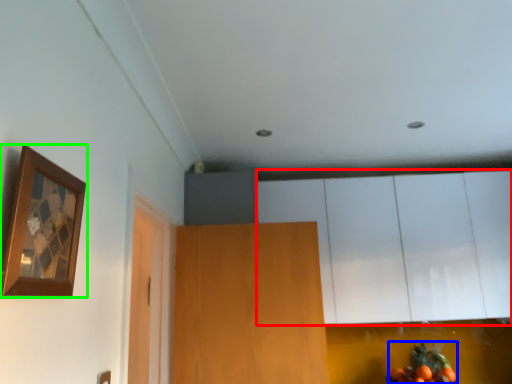
Question: Which object is the farthest from cabinetry (highlighted by a red box)? Choose among these: fruit (highlighted by a blue box) or picture frame (highlighted by a green box).

Choices:
 (A) fruit
 (B) picture frame

Answer: (B)